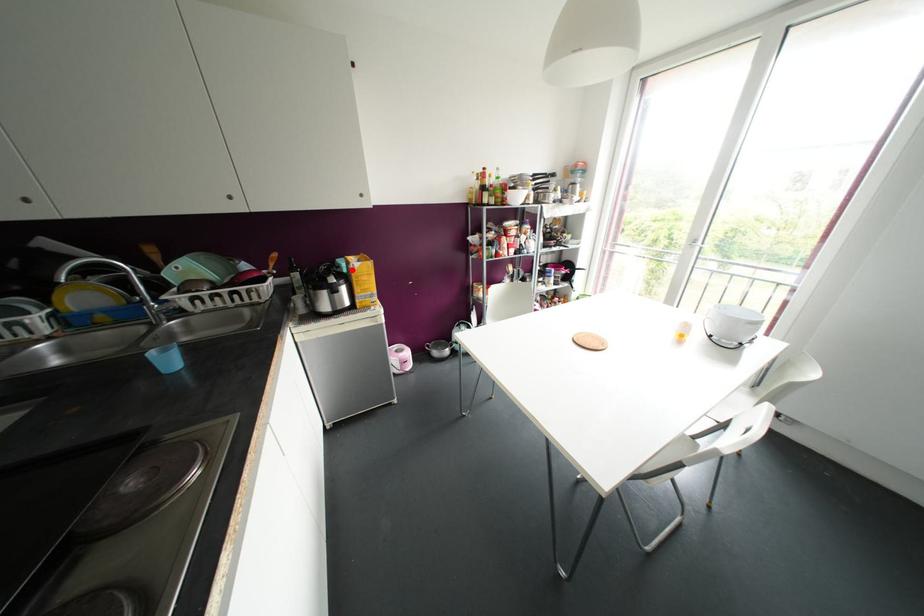
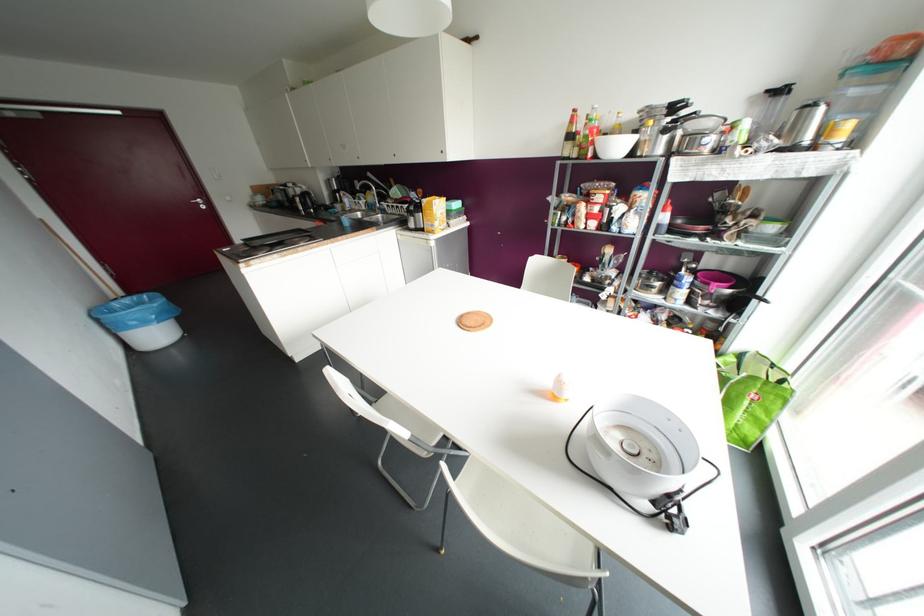
Question: I am providing you with two images of the same scene from different viewpoints. In image1, a red point is highlighted. Considering the same 3D point in image2, which of the following is correct?

Choices:
 (A) It is closer
 (B) It is farther

Answer: (A)